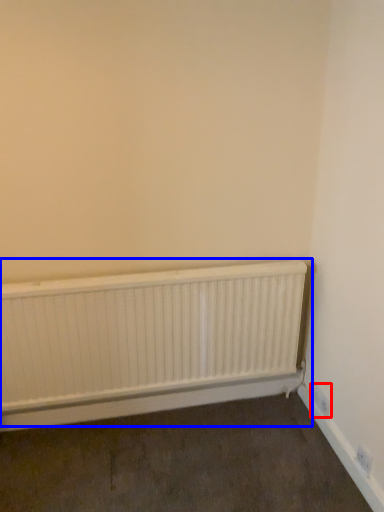
Question: Which object is further to the camera taking this photo, electric outlet (highlighted by a red box) or radiator (highlighted by a blue box)?

Choices:
 (A) electric outlet
 (B) radiator

Answer: (A)